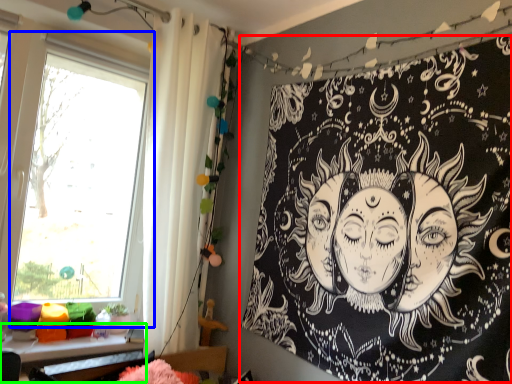
Question: Which object is positioned farthest from bulletin board (highlighted by a red box)? Select from window (highlighted by a blue box) and table (highlighted by a green box).

Choices:
 (A) window
 (B) table

Answer: (A)